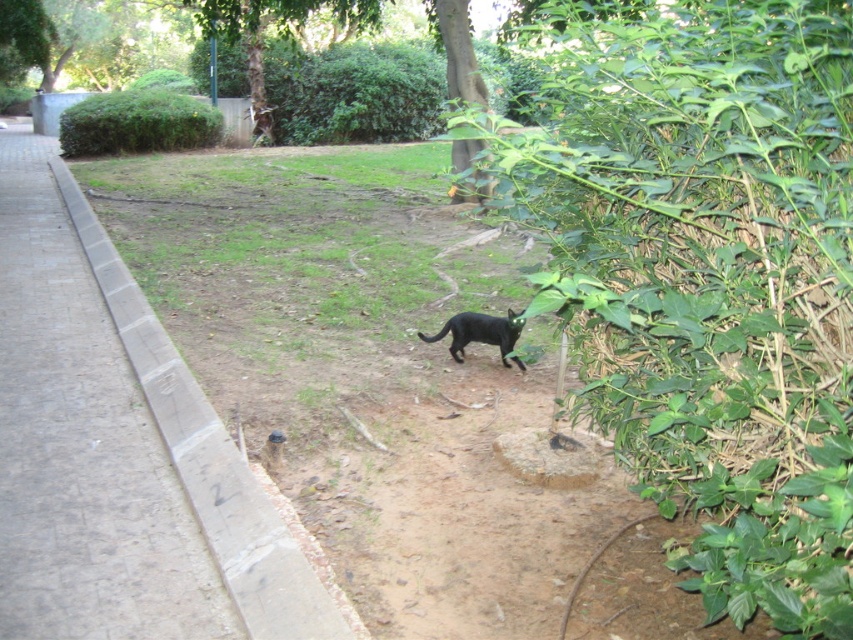
Does concrete pavement at left have a lesser width compared to shiny black cat at center?

Incorrect, concrete pavement at left's width is not less than shiny black cat at center's.

Is concrete pavement at left below shiny black cat at center?

Incorrect, concrete pavement at left is not positioned below shiny black cat at center.

This screenshot has width=853, height=640. I want to click on concrete pavement at left, so click(x=82, y=445).

Looking at this image, is black fur cat at center to the left of concrete pavement at left from the viewer's perspective?

Incorrect, black fur cat at center is not on the left side of concrete pavement at left.

Who is more distant from viewer, (x=579, y=625) or (x=77, y=316)?

The point (x=77, y=316) is more distant.

Image resolution: width=853 pixels, height=640 pixels. In order to click on black fur cat at center in this screenshot , I will do `click(364, 372)`.

The width and height of the screenshot is (853, 640). Find the location of `black fur cat at center`. black fur cat at center is located at coordinates (364, 372).

Is black fur cat at center shorter than shiny black cat at center?

No.

Is point (170, 288) behind point (509, 310)?

Yes, point (170, 288) is farther from viewer.

Image resolution: width=853 pixels, height=640 pixels. I want to click on black fur cat at center, so click(x=364, y=372).